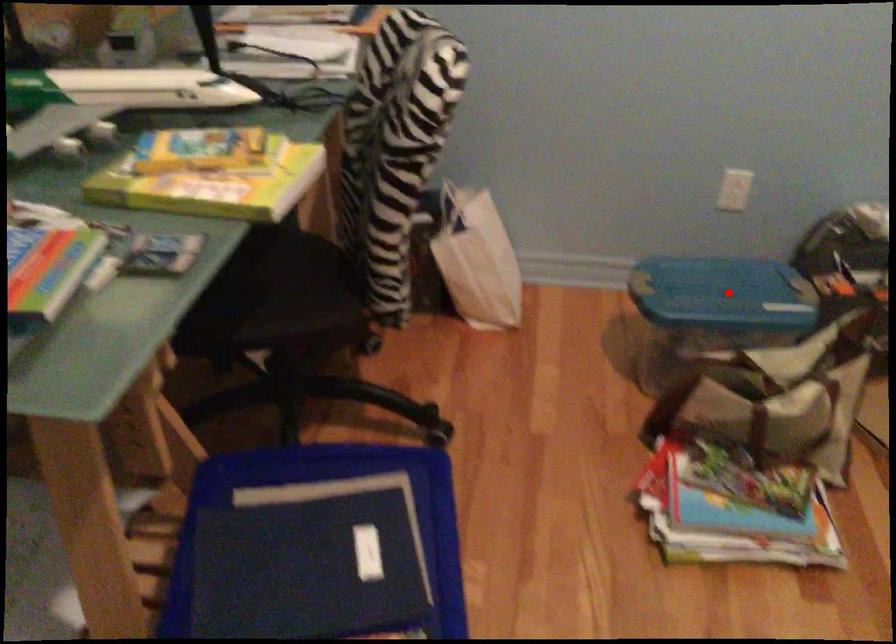
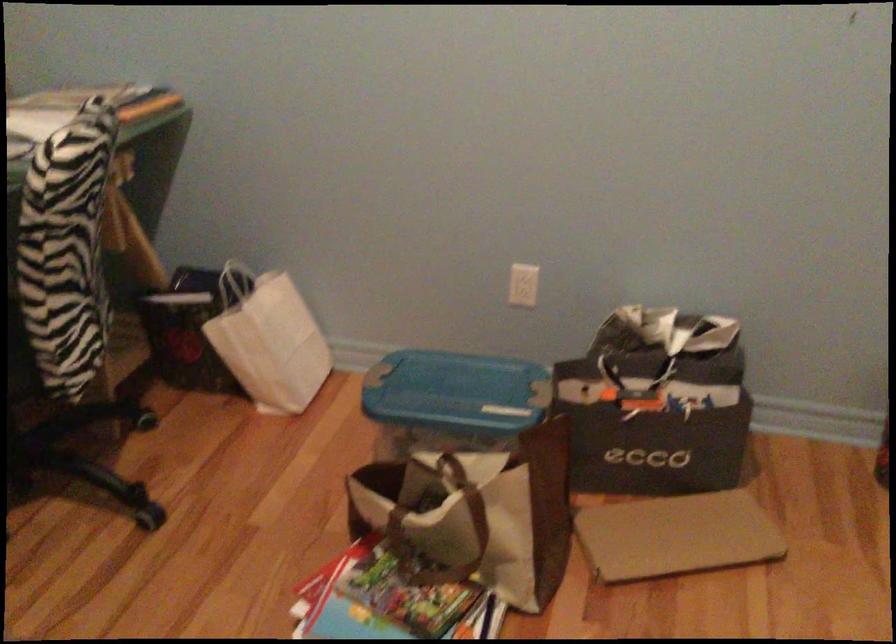
In the second image, find the point that corresponds to the highlighted location in the first image.

(455, 393)